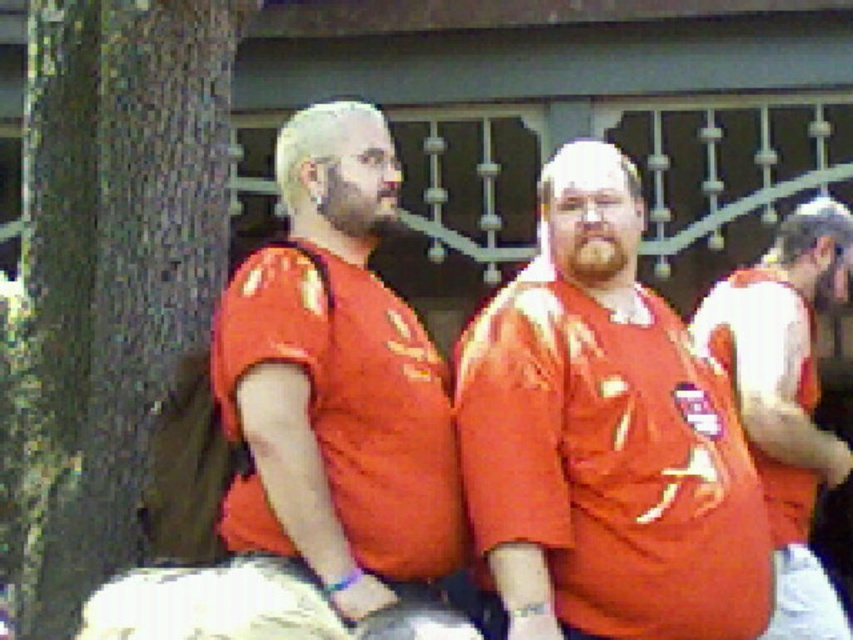
Between matte orange shirt at left and matte orange shirt at center, which one appears on the left side from the viewer's perspective?

matte orange shirt at left

Who is more forward, [235,576] or [796,396]?

Point [235,576]

You are a GUI agent. You are given a task and a screenshot of the screen. Output one action in this format:
    pyautogui.click(x=<x>, y=<y>)
    Task: Click on the matte orange shirt at left
    
    Given the screenshot: What is the action you would take?
    pyautogui.click(x=318, y=428)

Is point (309, 326) positioned in front of point (80, 19)?

Yes, point (309, 326) is closer to viewer.

Does matte orange shirt at left have a smaller size compared to brown rough bark at left?

Incorrect, matte orange shirt at left is not smaller in size than brown rough bark at left.

The width and height of the screenshot is (853, 640). I want to click on matte orange shirt at left, so click(x=318, y=428).

Identify the location of matte orange shirt at left. (318, 428).

Based on the photo, which is more to the left, matte orange t-shirt at center or matte orange shirt at center?

matte orange t-shirt at center is more to the left.

Does point (614, 560) lie in front of point (746, 403)?

Yes, it is.

Identify the location of matte orange t-shirt at center. This screenshot has width=853, height=640. [x=604, y=436].